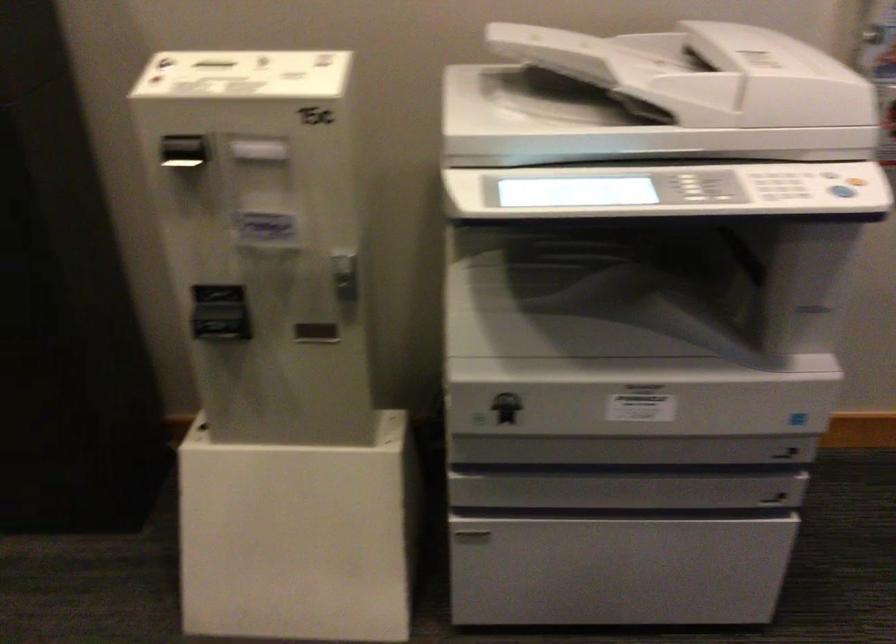
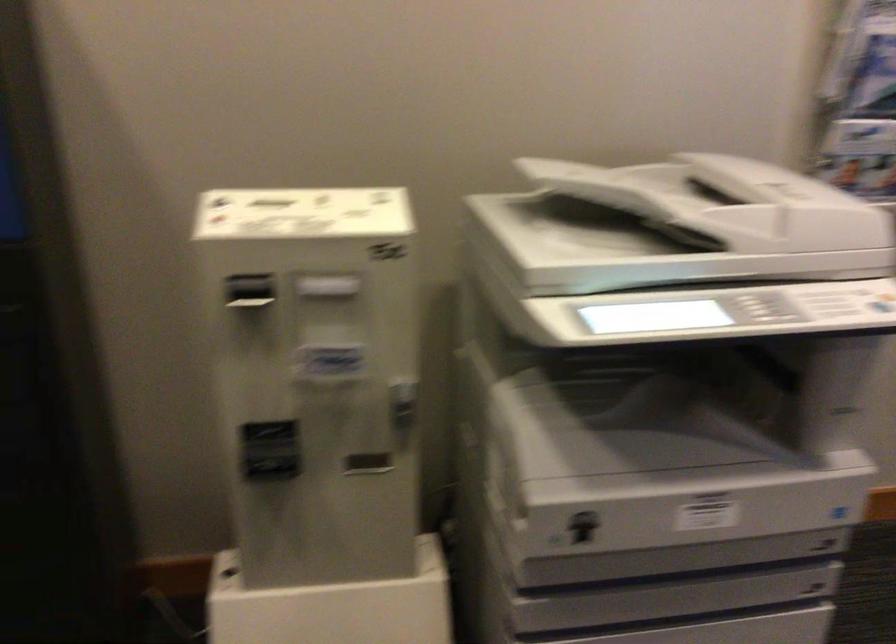
Find the pixel in the second image that matches point 507,406 in the first image.

(582, 526)